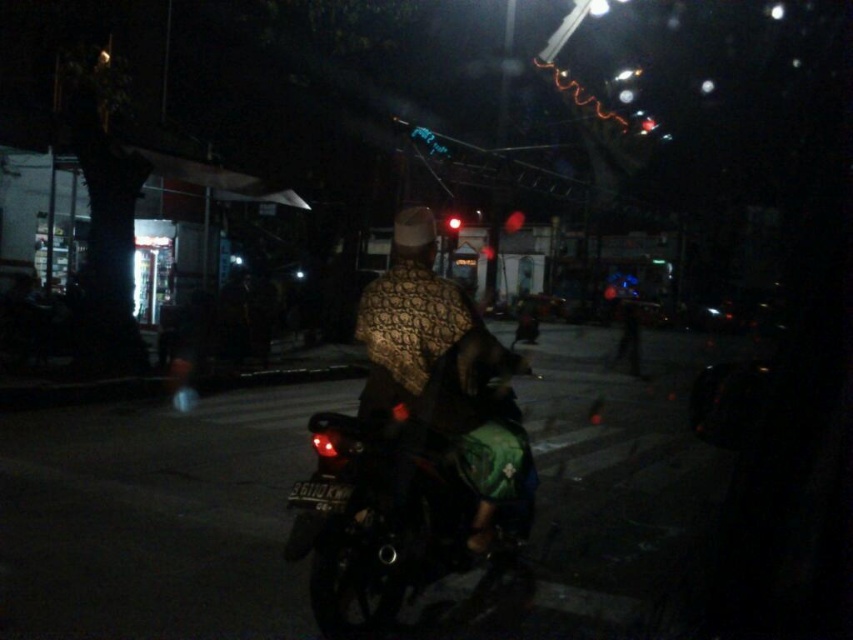
Which is above, shiny black motorcycle at center or red glass traffic light at center?

red glass traffic light at center is higher up.

Is shiny black motorcycle at center to the right of red glass traffic light at center from the viewer's perspective?

In fact, shiny black motorcycle at center is to the left of red glass traffic light at center.

Find the location of a particular element. This screenshot has width=853, height=640. shiny black motorcycle at center is located at coordinates (396, 518).

Does patterned fabric at center have a lesser height compared to red glass traffic light at center?

Yes.

This screenshot has width=853, height=640. What do you see at coordinates (439, 372) in the screenshot?
I see `patterned fabric at center` at bounding box center [439, 372].

Find the location of a particular element. Image resolution: width=853 pixels, height=640 pixels. patterned fabric at center is located at coordinates tap(439, 372).

Is shiny black motorcycle at center shorter than patterned fabric at center?

Incorrect, shiny black motorcycle at center's height does not fall short of patterned fabric at center's.

Where is `shiny black motorcycle at center`? The width and height of the screenshot is (853, 640). shiny black motorcycle at center is located at coordinates (396, 518).